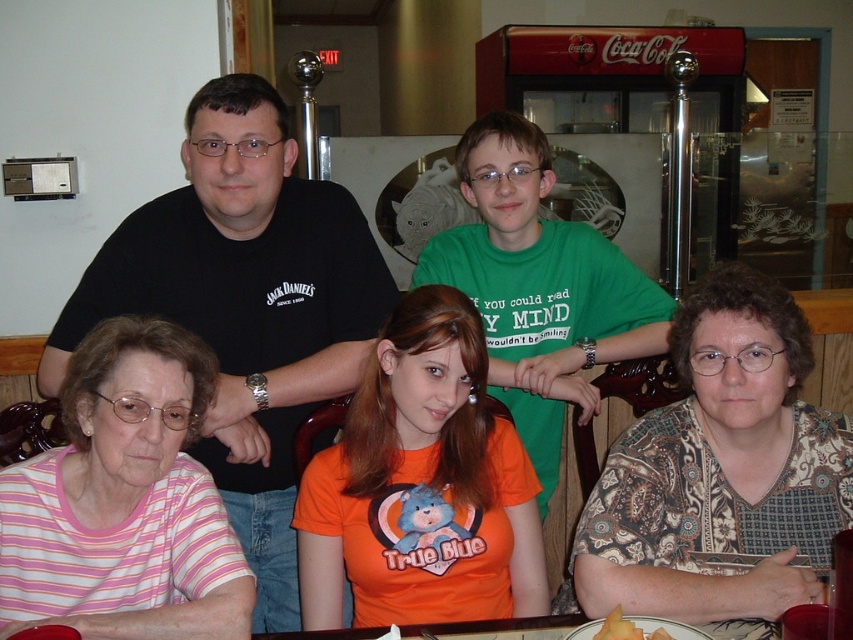
You are a server at the restaurant. You need to deliver a drink to the person wearing the pink striped shirt at lower left. The table is 1.5 meters long. Can you reach them from your current position at the end of the table without walking around?

The distance between you and the person wearing the pink striped shirt at lower left is 1.14 meters, which is shorter than the table length of 1.5 meters. Therefore, you can reach them without needing to walk around the table.

You are a photographer positioned at the center of the room. You want to take a photo that includes the pink striped shirt at lower left. Based on its position, which direction should you face to ensure it is in the frame?

The pink striped shirt at lower left is located at point [125,500], so you should face towards the lower left direction to include it in the frame.